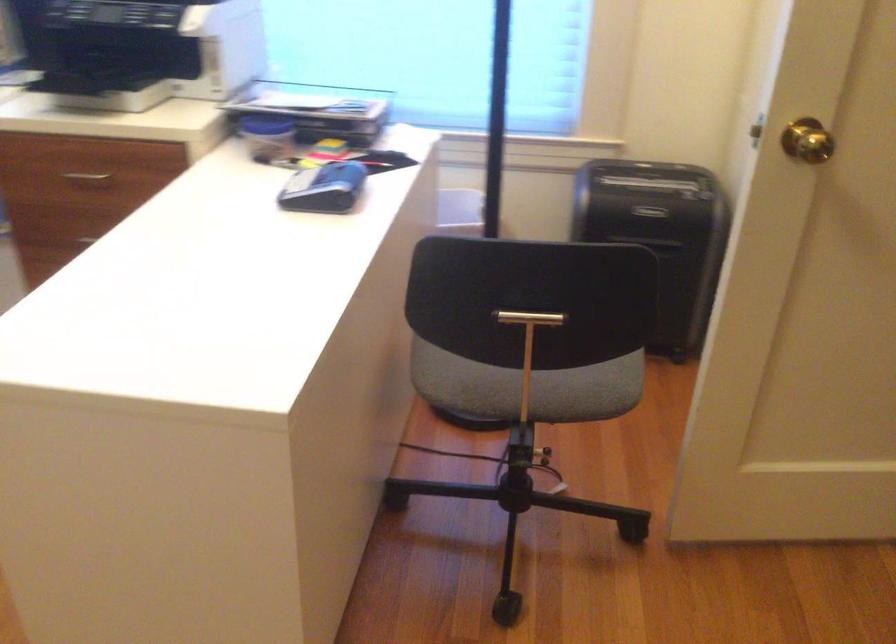
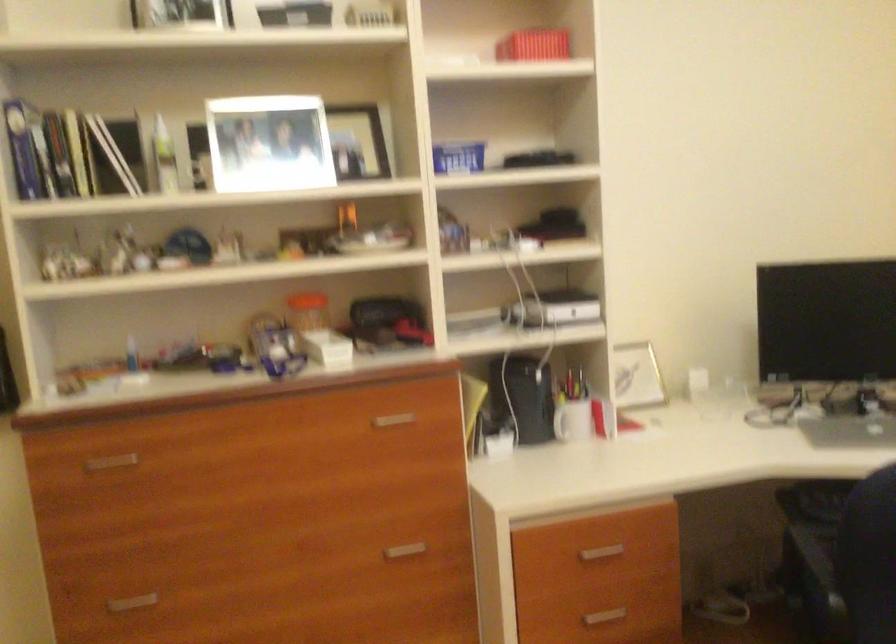
Question: The camera is either moving clockwise (left) or counter-clockwise (right) around the object. The first image is from the beginning of the video and the second image is from the end. Is the camera moving left or right when shooting the video?

Choices:
 (A) Left
 (B) Right

Answer: (B)